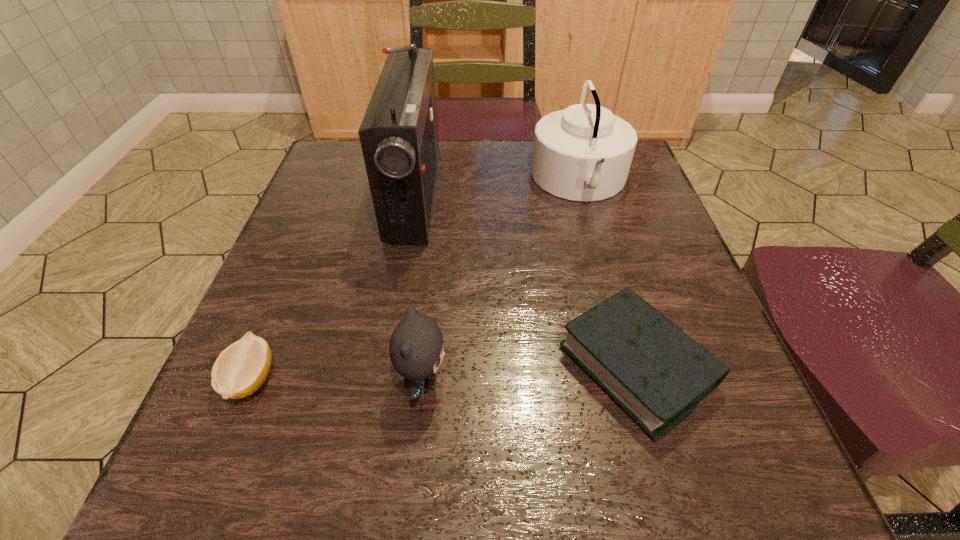
Identify the location of vacant space that's between the Bible and the third tallest object. (530, 373).

Find the location of a particular element. The image size is (960, 540). free space between the leftmost object and the third tallest object is located at coordinates (337, 380).

I want to click on vacant area that lies between the Bible and the third tallest object, so click(x=530, y=373).

Image resolution: width=960 pixels, height=540 pixels. I want to click on vacant point located between the Bible and the leftmost object, so click(444, 373).

Locate an element on the screen. Image resolution: width=960 pixels, height=540 pixels. free space that is in between the third shortest object and the leftmost object is located at coordinates (337, 380).

You are a GUI agent. You are given a task and a screenshot of the screen. Output one action in this format:
    pyautogui.click(x=<x>, y=<y>)
    Task: Click on the vacant area that lies between the second tallest object and the kitten
    
    Given the screenshot: What is the action you would take?
    pyautogui.click(x=501, y=281)

Identify the location of the fourth closest object to the Bible. (241, 368).

Where is `the closest object to the Bible`? The width and height of the screenshot is (960, 540). the closest object to the Bible is located at coordinates (416, 346).

Identify the location of free spot that satisfies the following two spatial constraints: 1. on the front-facing side of the Bible; 2. on the right side of the radio receiver. (384, 366).

Identify the location of free space that satisfies the following two spatial constraints: 1. on the front-facing side of the Bible; 2. on the right side of the radio receiver. (384, 366).